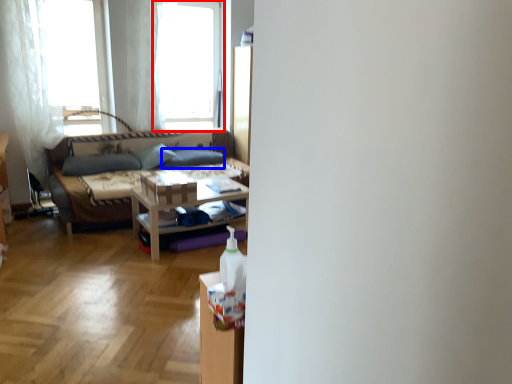
Question: Among these objects, which one is nearest to the camera, window (highlighted by a red box) or pillow (highlighted by a blue box)?

Choices:
 (A) window
 (B) pillow

Answer: (A)